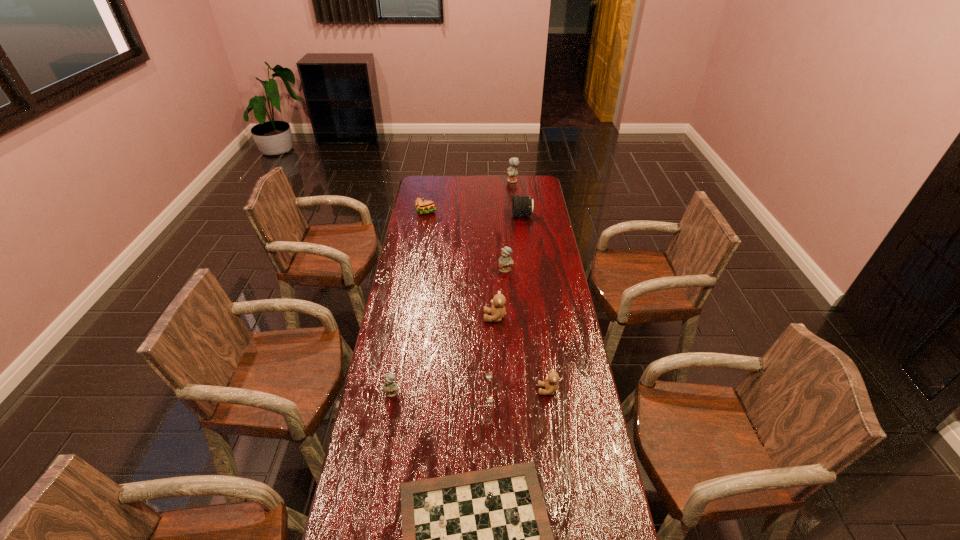
This screenshot has height=540, width=960. Identify the location of vacant area situated at the front element of the black telephoto lens. (497, 215).

I want to click on free space located 0.120m at the front element of the black telephoto lens, so click(490, 215).

Identify the location of vacant space situated 0.250m at the front element of the black telephoto lens. The image size is (960, 540). 465,215.

Where is `free space located on the right of the sandwich`? free space located on the right of the sandwich is located at coordinates (496, 212).

The height and width of the screenshot is (540, 960). In order to click on free location located on the face of the smaller brown teddy bear in this screenshot , I will do pos(515,390).

The height and width of the screenshot is (540, 960). What are the coordinates of `vacant space situated on the face of the smaller brown teddy bear` in the screenshot? It's located at (485, 390).

What are the coordinates of `free space located on the face of the smaller brown teddy bear` in the screenshot? It's located at (473, 390).

Identify the location of vacant area situated on the front-facing side of the leftmost blue teddy bear. Image resolution: width=960 pixels, height=540 pixels. (374, 499).

Image resolution: width=960 pixels, height=540 pixels. In order to click on blank area located on the front lenses of the shortest object in this screenshot , I will do `click(564, 396)`.

I want to click on object positioned at the far edge, so click(512, 171).